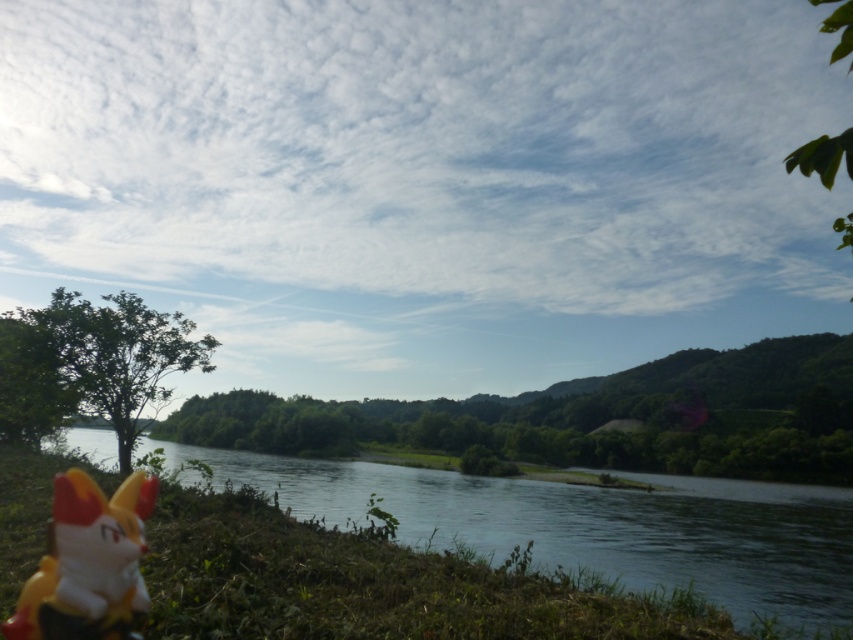
Question: Does clear water at river left have a greater width compared to yellow plastic toy at lower left?

Choices:
 (A) no
 (B) yes

Answer: (B)

Question: Does clear water at river left have a lesser width compared to yellow plastic toy at lower left?

Choices:
 (A) no
 (B) yes

Answer: (A)

Question: Which point appears closest to the camera in this image?

Choices:
 (A) (144, 484)
 (B) (795, 525)

Answer: (A)

Question: Considering the relative positions of clear water at river left and yellow plastic toy at lower left in the image provided, where is clear water at river left located with respect to yellow plastic toy at lower left?

Choices:
 (A) below
 (B) above

Answer: (A)

Question: Among these points, which one is farthest from the camera?

Choices:
 (A) (149, 509)
 (B) (260, 474)

Answer: (B)